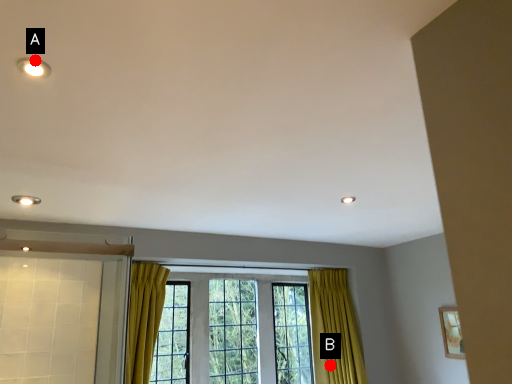
Question: Two points are circled on the image, labeled by A and B beside each circle. Which point is further to the camera?

Choices:
 (A) A is further
 (B) B is further

Answer: (B)